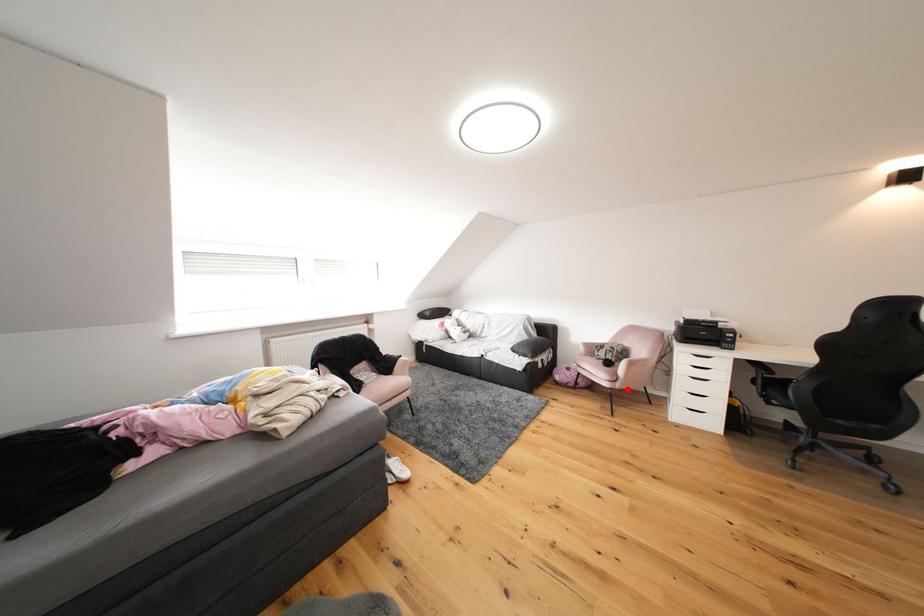
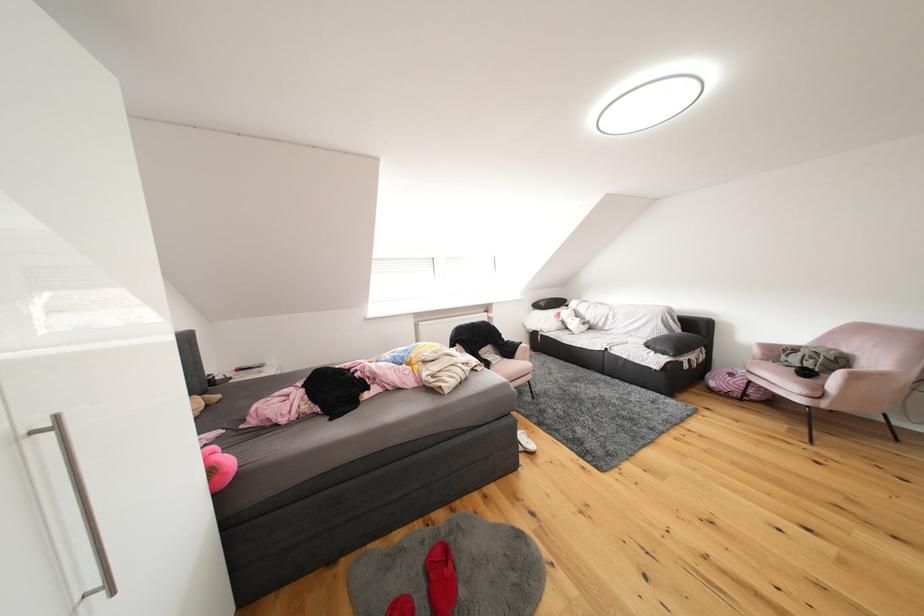
Locate, in the second image, the point that corresponds to the highlighted location in the first image.

(834, 408)